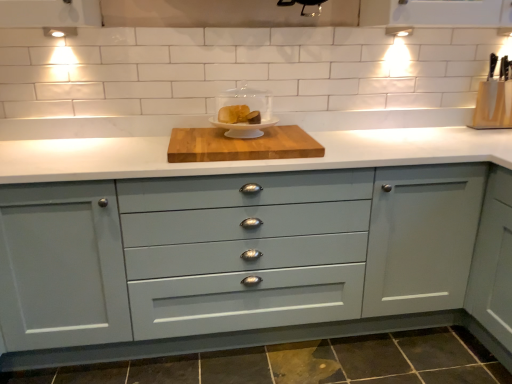
The image size is (512, 384). In order to click on free point above matte gray cabinet at center (from a real-world perspective) in this screenshot , I will do `click(221, 151)`.